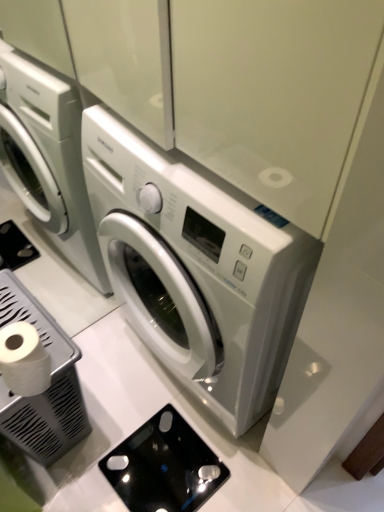
This screenshot has height=512, width=384. I want to click on vacant area that is in front of white glossy washing machine at center, so click(x=192, y=455).